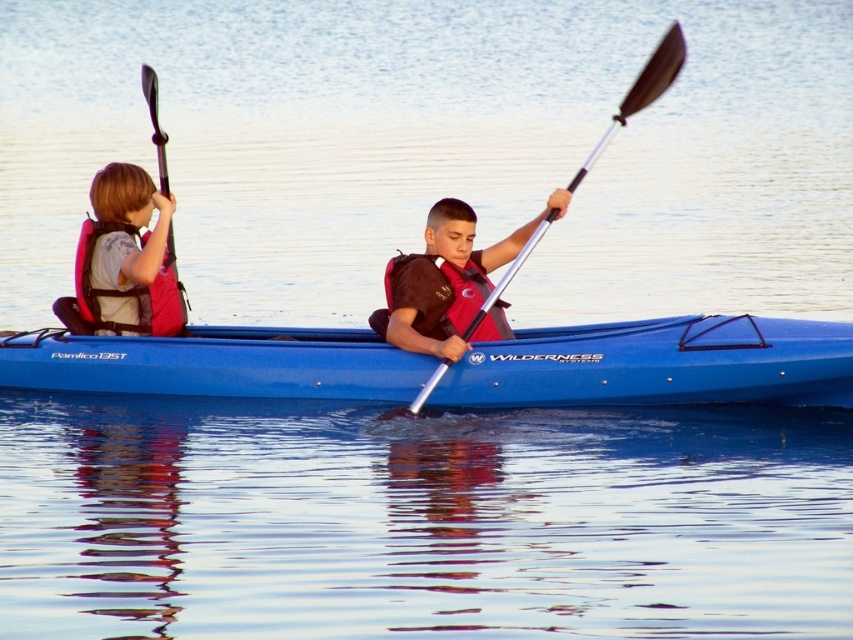
Between red matte life jacket at center and matte pink life jacket at left, which one is positioned lower?

Positioned lower is red matte life jacket at center.

Does red matte life jacket at center come behind matte pink life jacket at left?

No, red matte life jacket at center is in front of matte pink life jacket at left.

In the scene shown: Who is more forward, (412, 282) or (120, 324)?

Positioned in front is point (412, 282).

Find the location of `red matte life jacket at center`. red matte life jacket at center is located at coordinates (433, 292).

Which of these two, brown fabric life vest at center or red matte life jacket at center, stands shorter?

Standing shorter between the two is red matte life jacket at center.

Does brown fabric life vest at center have a lesser width compared to red matte life jacket at center?

Incorrect, brown fabric life vest at center's width is not less than red matte life jacket at center's.

Is point (370, 314) less distant than point (387, 307)?

No, it is behind (387, 307).

Where is `brown fabric life vest at center`? The image size is (853, 640). brown fabric life vest at center is located at coordinates (444, 276).

Can you confirm if silver metallic paddle at center is thinner than matte pink life jacket at left?

No.

Who is more distant from viewer, (477, 337) or (144, 294)?

The point (144, 294) is more distant.

Where is `silver metallic paddle at center`? The height and width of the screenshot is (640, 853). silver metallic paddle at center is located at coordinates (641, 92).